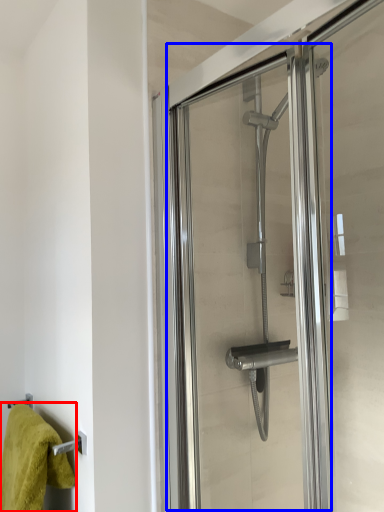
Question: Among these objects, which one is farthest to the camera, towel (highlighted by a red box) or screen door (highlighted by a blue box)?

Choices:
 (A) towel
 (B) screen door

Answer: (A)